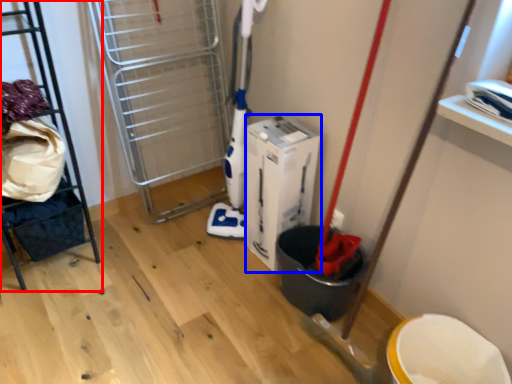
Question: Among these objects, which one is farthest to the camera, furniture (highlighted by a red box) or wide (highlighted by a blue box)?

Choices:
 (A) furniture
 (B) wide

Answer: (B)